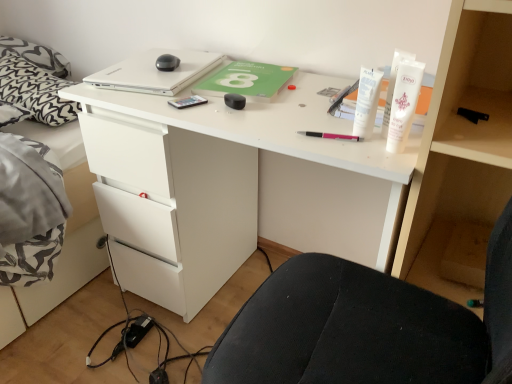
Locate an element on the screen. The width and height of the screenshot is (512, 384). vacant area that lies between white matte tube at upper right, arranged as the second toiletry when viewed from the left, and black rubberized mouse at center, the 2th stationery in the left-to-right sequence is located at coordinates (295, 121).